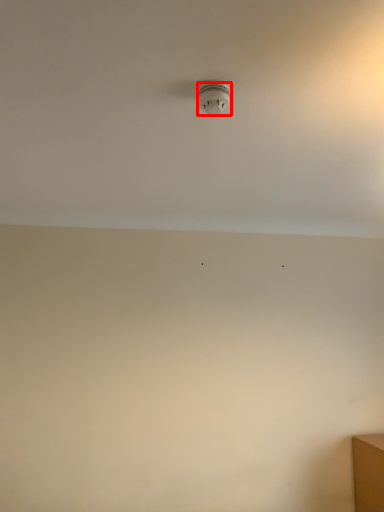
Question: In this image, where is light fixture (annotated by the red box) located relative to backdrop?

Choices:
 (A) right
 (B) left

Answer: (B)